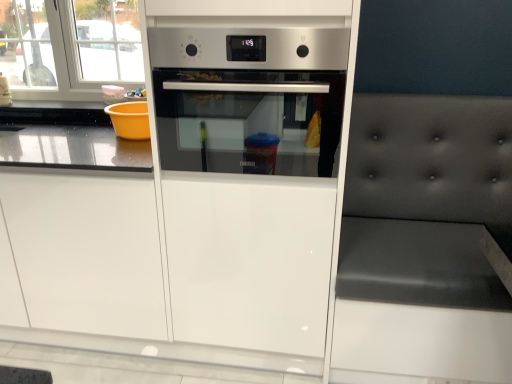
Question: From a real-world perspective, is dark gray tufted cushion at right over satin silver oven at center?

Choices:
 (A) yes
 (B) no

Answer: (B)

Question: Can you confirm if dark gray tufted cushion at right is thinner than satin silver oven at center?

Choices:
 (A) no
 (B) yes

Answer: (B)

Question: Is dark gray tufted cushion at right to the right of satin silver oven at center from the viewer's perspective?

Choices:
 (A) no
 (B) yes

Answer: (B)

Question: Is satin silver oven at center located within dark gray tufted cushion at right?

Choices:
 (A) yes
 (B) no

Answer: (B)

Question: Is dark gray tufted cushion at right taller than satin silver oven at center?

Choices:
 (A) no
 (B) yes

Answer: (B)

Question: In the image, is dark gray tufted cushion at right positioned in front of or behind satin silver oven at center?

Choices:
 (A) front
 (B) behind

Answer: (A)

Question: From a real-world perspective, relative to satin silver oven at center, is dark gray tufted cushion at right vertically above or below?

Choices:
 (A) above
 (B) below

Answer: (B)

Question: Does point (352, 354) appear closer or farther from the camera than point (180, 72)?

Choices:
 (A) farther
 (B) closer

Answer: (A)

Question: In terms of size, does dark gray tufted cushion at right appear bigger or smaller than satin silver oven at center?

Choices:
 (A) small
 (B) big

Answer: (B)

Question: Is point (198, 147) positioned closer to the camera than point (35, 301)?

Choices:
 (A) closer
 (B) farther

Answer: (B)

Question: Is satin silver oven at center taller or shorter than white glossy drawer at center?

Choices:
 (A) tall
 (B) short

Answer: (B)

Question: Is satin silver oven at center bigger or smaller than white glossy drawer at center?

Choices:
 (A) big
 (B) small

Answer: (B)

Question: From a real-world perspective, is satin silver oven at center above or below white glossy drawer at center?

Choices:
 (A) below
 (B) above

Answer: (B)

Question: From a real-world perspective, is satin silver oven at center physically located above or below satin silver oven at center?

Choices:
 (A) below
 (B) above

Answer: (A)

Question: Which is correct: satin silver oven at center is inside satin silver oven at center, or outside of it?

Choices:
 (A) outside
 (B) inside

Answer: (B)